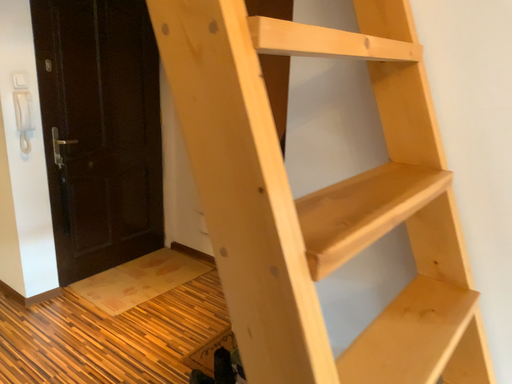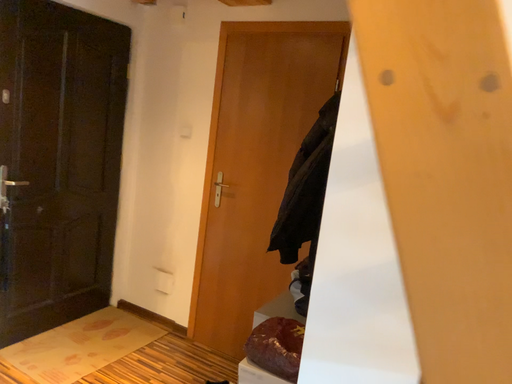
Question: Which way did the camera rotate in the video?

Choices:
 (A) rotated left
 (B) rotated right

Answer: (B)